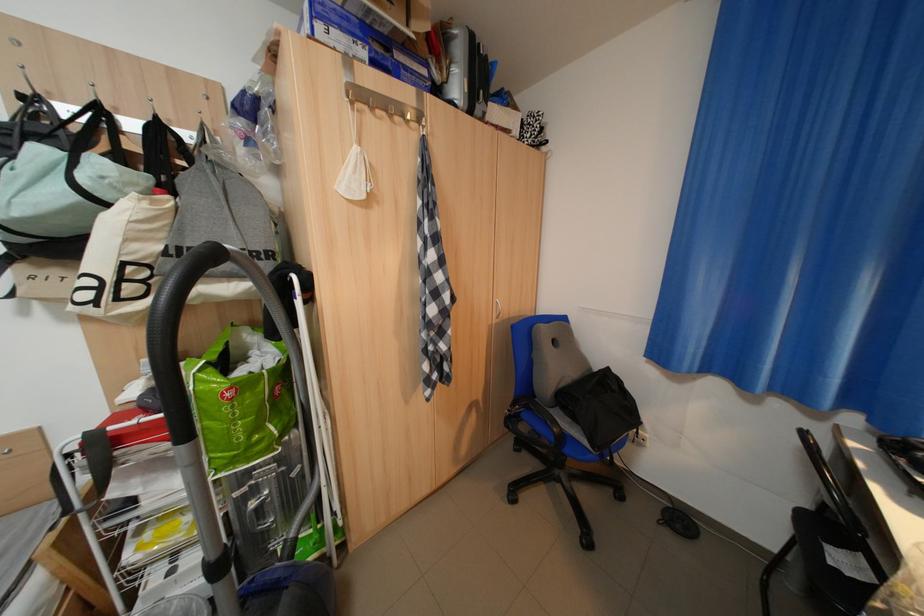
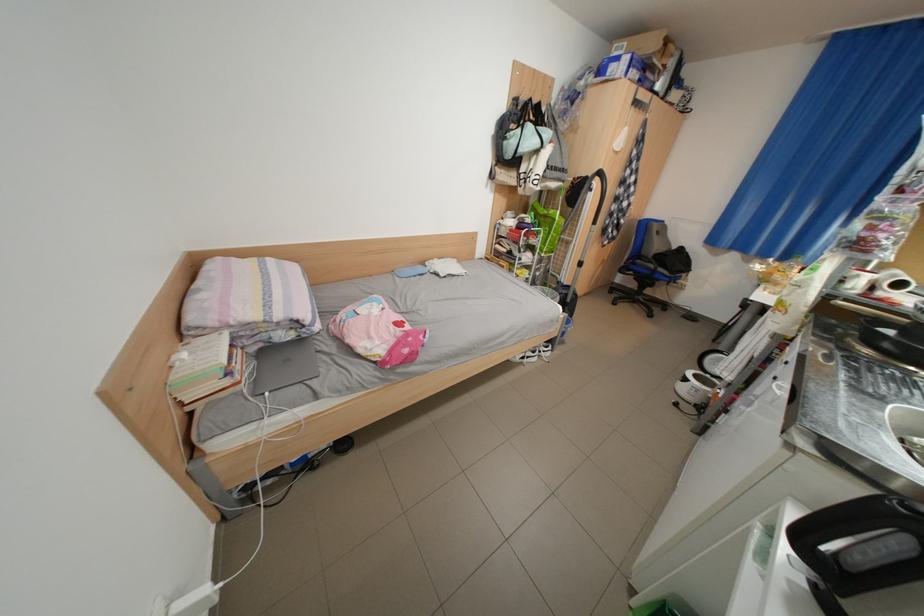
Where in the second image is the point corresponding to point (88, 199) from the first image?

(552, 147)